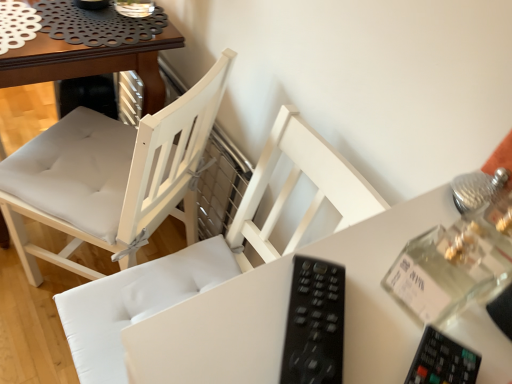
Question: Is black plastic remote at center a part of white fabric chair at center, which ranks as the first chair in left-to-right order?

Choices:
 (A) no
 (B) yes

Answer: (A)

Question: Is white fabric chair at center, the 2th chair from the right, outside black plastic remote at center?

Choices:
 (A) no
 (B) yes

Answer: (B)

Question: Is white fabric chair at center, the 2th chair from the right, smaller than black plastic remote at center?

Choices:
 (A) yes
 (B) no

Answer: (B)

Question: Are white fabric chair at center, which ranks as the first chair in left-to-right order, and black plastic remote at center far apart?

Choices:
 (A) no
 (B) yes

Answer: (A)

Question: Can you confirm if white fabric chair at center, which ranks as the first chair in left-to-right order, is taller than black plastic remote at center?

Choices:
 (A) no
 (B) yes

Answer: (B)

Question: Does white fabric chair at center, the 2th chair from the right, turn towards black plastic remote at center?

Choices:
 (A) yes
 (B) no

Answer: (B)

Question: Is white fabric chair at center, which ranks as the first chair in left-to-right order, inside white wood chair at center, which ranks as the 1th chair in right-to-left order?

Choices:
 (A) no
 (B) yes

Answer: (A)

Question: Can you confirm if white wood chair at center, placed as the second chair when sorted from left to right, is positioned to the left of white fabric chair at center, which ranks as the first chair in left-to-right order?

Choices:
 (A) yes
 (B) no

Answer: (B)

Question: Is white wood chair at center, placed as the second chair when sorted from left to right, next to white fabric chair at center, which ranks as the first chair in left-to-right order?

Choices:
 (A) yes
 (B) no

Answer: (B)

Question: Can you confirm if white wood chair at center, which ranks as the 1th chair in right-to-left order, is smaller than white fabric chair at center, the 2th chair from the right?

Choices:
 (A) yes
 (B) no

Answer: (A)

Question: Does white wood chair at center, which ranks as the 1th chair in right-to-left order, lie in front of white fabric chair at center, the 2th chair from the right?

Choices:
 (A) no
 (B) yes

Answer: (B)

Question: Can you confirm if white wood chair at center, placed as the second chair when sorted from left to right, is wider than white fabric chair at center, the 2th chair from the right?

Choices:
 (A) yes
 (B) no

Answer: (B)

Question: Considering the relative positions of white wood chair at center, which ranks as the 1th chair in right-to-left order, and black plastic remote at center in the image provided, is white wood chair at center, which ranks as the 1th chair in right-to-left order, to the left of black plastic remote at center from the viewer's perspective?

Choices:
 (A) no
 (B) yes

Answer: (B)